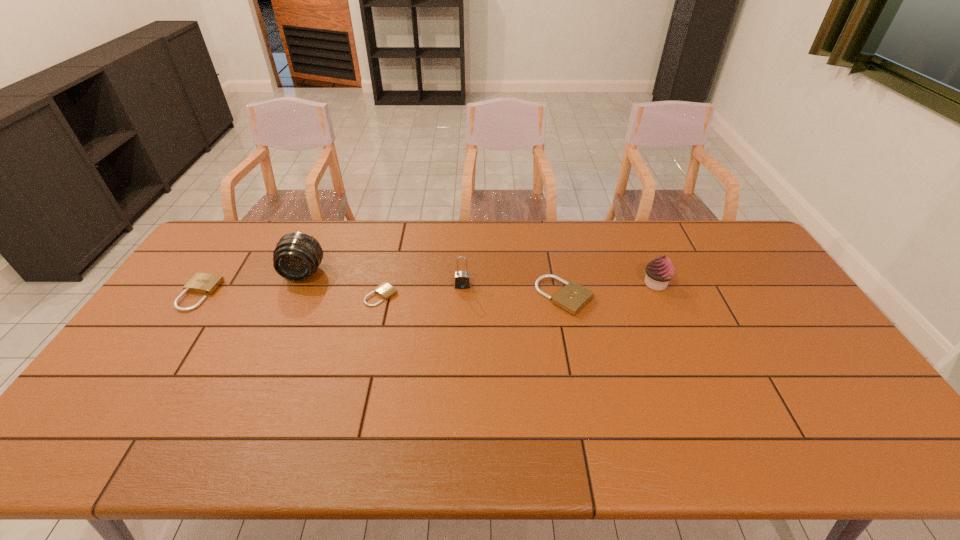
You are a GUI agent. You are given a task and a screenshot of the screen. Output one action in this format:
    pyautogui.click(x=<x>, y=<y>)
    Task: Click on the vacant space at the right edge
    This screenshot has height=540, width=960.
    Given the screenshot: What is the action you would take?
    pyautogui.click(x=770, y=279)

The image size is (960, 540). In the image, there is a desktop. Find the location of `free space at the near right corner`. free space at the near right corner is located at coordinates (812, 407).

Find the location of a particular element. unoccupied position between the leftmost padlock and the rightmost object is located at coordinates (428, 289).

This screenshot has height=540, width=960. I want to click on vacant area between the fifth object from left to right and the shortest object, so click(x=473, y=296).

Locate an element on the screen. Image resolution: width=960 pixels, height=540 pixels. free point between the rightmost object and the fourth object from right to left is located at coordinates (518, 289).

I want to click on vacant space that's between the shortest padlock and the rightmost object, so click(x=518, y=289).

Locate an element on the screen. unoccupied area between the tallest padlock and the telephoto lens is located at coordinates (383, 279).

Where is `empty space that is in between the leftmost padlock and the cupcake`? empty space that is in between the leftmost padlock and the cupcake is located at coordinates (428, 289).

Where is `free space that is in between the tallest padlock and the leftmost padlock`? This screenshot has width=960, height=540. free space that is in between the tallest padlock and the leftmost padlock is located at coordinates (331, 290).

Locate an element on the screen. vacant area between the rightmost padlock and the fifth object from right to left is located at coordinates (434, 285).